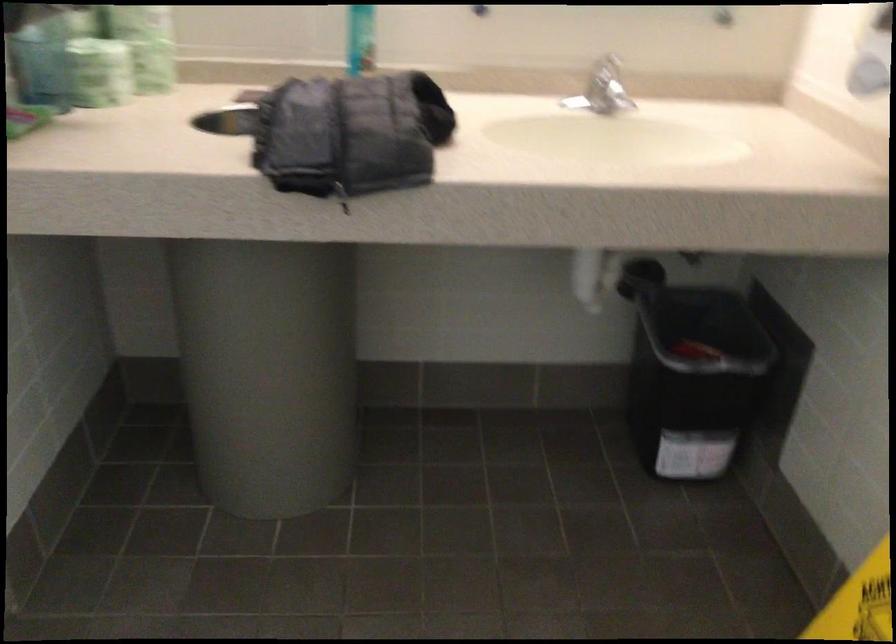
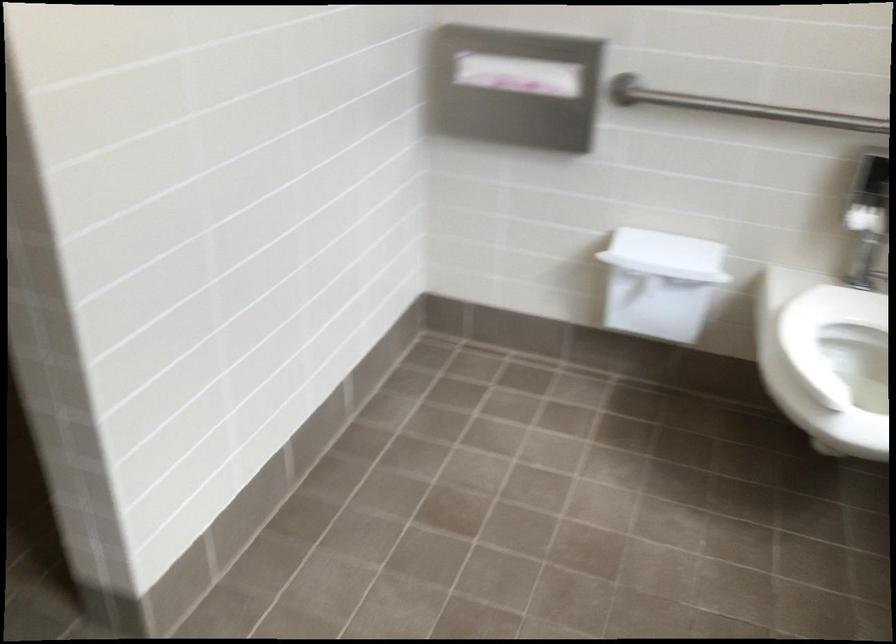
Question: What movement of the cameraman would produce the second image?

Choices:
 (A) Left
 (B) Right
 (C) Forward
 (D) Backward

Answer: (B)